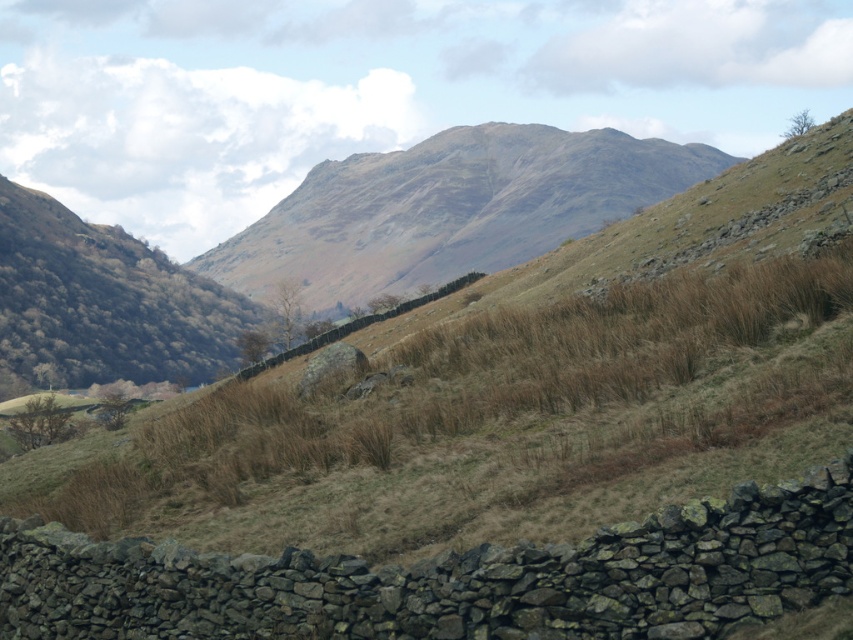
You are a hiker trying to cross the rugged stone mountain at center. You have a map showing a narrow path through the brown dry grass at center. Can you fit through the path if your backpack is 2 feet wide?

The brown dry grass at center is thinner than rugged stone mountain at center, but the description does not provide specific measurements about the path width. Therefore, it is uncertain if the backpack will fit through the path.

You are standing at the point labeled as point (486, 420) in the image. What do you see directly in front of you?

You see brown dry grass at center directly in front of you at point (486, 420).

You are standing at the origin point of the image. Which direction should you move to reach the brown dry grass at center?

The brown dry grass at center is located at coordinates point (486, 420), so you should move towards the upper right direction from the origin point to reach it.